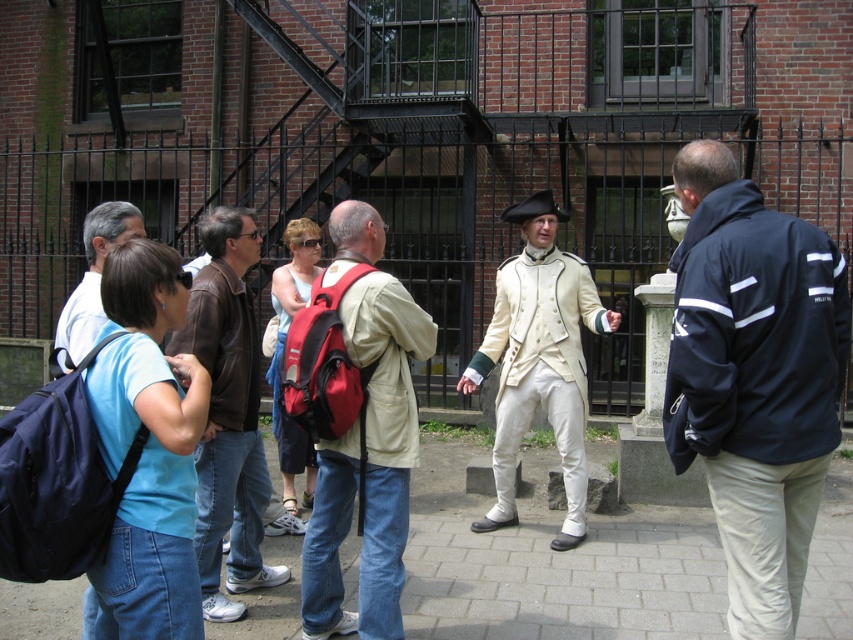
What is located at the point with coordinates (x=366, y=440) in the image?

The point at coordinates (x=366, y=440) corresponds to the matte beige coat at center.

You are a tour guide standing 4 feet away from the matte beige coat at center. You need to hand a pamphlet to the person wearing the blue fabric shirt at left. Can you reach them without moving closer?

The distance between the matte beige coat at center and the blue fabric shirt at left is 3.99 feet. Since you are already 4 feet away from the matte beige coat at center, the total distance to the blue fabric shirt at left would be approximately 7.99 feet. This distance is too far to reach without moving closer, so you would need to approach them to hand the pamphlet.

You are part of the group observing the historical presentation. You notice two people wearing the blue fabric shirt at center and the matte beige coat at center. Which one is closer to the speaker?

The blue fabric shirt at center is closer to the speaker because it is in front of the matte beige coat at center.